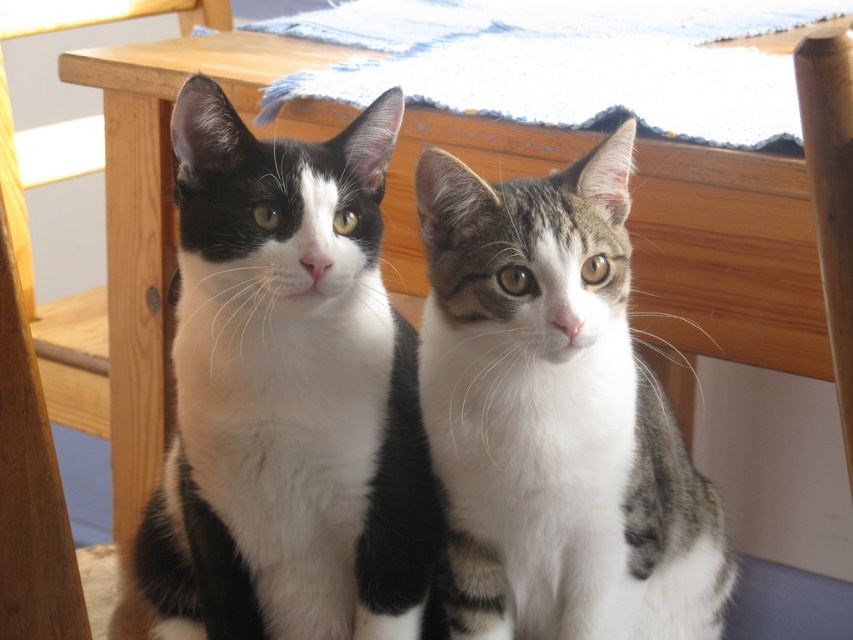
Looking at this image, you are observing two cats sitting together indoors. The cats are the black and white fur cat at center and another cat. Which cat is positioned closer to the left side of the image?

The black and white fur cat at center is located at point (287,394), which means it is positioned closer to the left side of the image compared to the other cat.

You are a photographer trying to capture both cats in a single photo. Since the black and white fur cat at center and the tabby fur cat at center are overlapping, which cat is blocking the view of the other?

The black and white fur cat at center is positioned over the tabby fur cat at center, so it is blocking the view of the tabby fur cat at center.